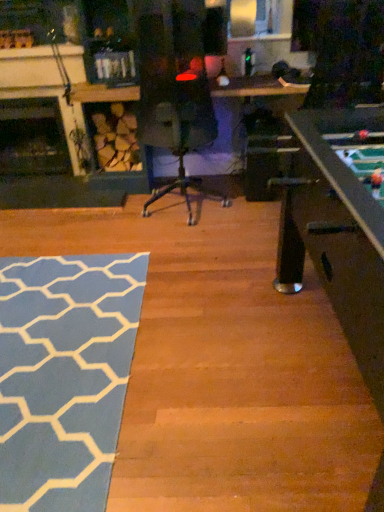
The width and height of the screenshot is (384, 512). I want to click on vacant area located to the right-hand side of blue textured rug at lower left, so click(224, 341).